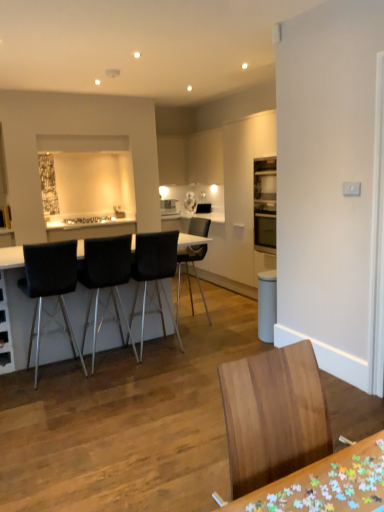
Question: Is black leather chair at left, the 2th chair from the front, shorter than black leather chair at center, placed as the 5th chair when sorted from front to back?

Choices:
 (A) no
 (B) yes

Answer: (A)

Question: Is black leather chair at left, the 2th chair from the front, looking in the opposite direction of black leather chair at center, acting as the first chair starting from the back?

Choices:
 (A) yes
 (B) no

Answer: (B)

Question: Is black leather chair at center, acting as the first chair starting from the back, surrounded by black leather chair at left, the 2th chair from the front?

Choices:
 (A) no
 (B) yes

Answer: (A)

Question: Considering the relative sizes of black leather chair at left, the 2th chair from the front, and black leather chair at center, placed as the 5th chair when sorted from front to back, in the image provided, is black leather chair at left, the 2th chair from the front, smaller than black leather chair at center, placed as the 5th chair when sorted from front to back,?

Choices:
 (A) yes
 (B) no

Answer: (B)

Question: From a real-world perspective, is black leather chair at left, the 4th chair in the back-to-front sequence, on black leather chair at center, acting as the first chair starting from the back?

Choices:
 (A) no
 (B) yes

Answer: (B)

Question: From a real-world perspective, does black leather chair at left, the 4th chair in the back-to-front sequence, sit lower than black leather chair at center, placed as the 5th chair when sorted from front to back?

Choices:
 (A) yes
 (B) no

Answer: (B)

Question: Is wooden chair at center, the first chair viewed from the front, far away from black leather table at center, marked as the second table in a right-to-left arrangement?

Choices:
 (A) no
 (B) yes

Answer: (B)

Question: Is wooden chair at center, the first chair viewed from the front, shorter than black leather table at center, placed as the 1th table when sorted from top to bottom?

Choices:
 (A) yes
 (B) no

Answer: (A)

Question: Is wooden chair at center, acting as the fifth chair starting from the back, touching black leather table at center, which appears as the 2th table when ordered from the bottom?

Choices:
 (A) no
 (B) yes

Answer: (A)

Question: Is wooden chair at center, acting as the fifth chair starting from the back, wider than black leather table at center, which appears as the 2th table when ordered from the bottom?

Choices:
 (A) yes
 (B) no

Answer: (B)

Question: Is wooden chair at center, acting as the fifth chair starting from the back, located outside black leather table at center, which appears as the 2th table when ordered from the bottom?

Choices:
 (A) yes
 (B) no

Answer: (A)

Question: Can you confirm if wooden chair at center, the first chair viewed from the front, is taller than black leather table at center, positioned as the 2th table in front-to-back order?

Choices:
 (A) no
 (B) yes

Answer: (A)

Question: From the image's perspective, is black leather chair at center, acting as the first chair starting from the back, on top of black leather table at center, the 1th table from the left?

Choices:
 (A) yes
 (B) no

Answer: (A)